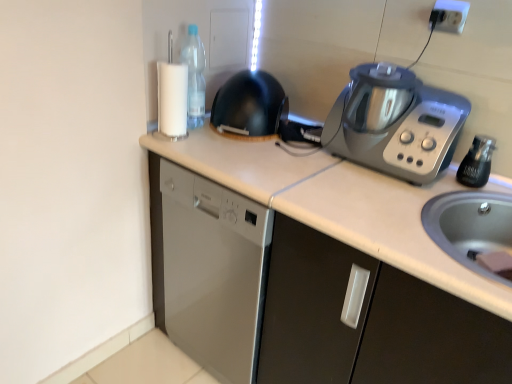
The height and width of the screenshot is (384, 512). Find the location of `vacant region in front of silver metallic kitchen appliance at upper right`. vacant region in front of silver metallic kitchen appliance at upper right is located at coordinates (368, 206).